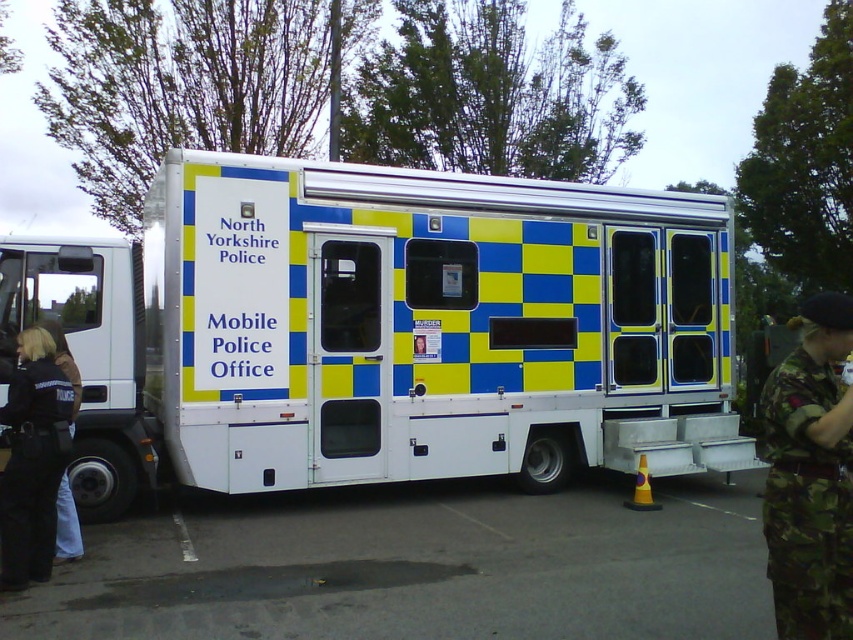
You are a police officer standing in front of the North Yorkshire Police Mobile Police Office. You notice two points marked on the side of the vehicle. The first point is at coordinate point (36, 502) and the second is at coordinate point (61, 342). Which point is closer to your current position?

Point (36, 502) is closer to the camera than point (61, 342), so the first point is closer to your current position.

You are a police officer standing in front of the North Yorkshire Police Mobile Police Office. You notice two black uniforms hanging on hooks near the entrance. One is labeled as the black uniform at lower left and the other as the black uniform at left. Which uniform is positioned lower on the hook?

The black uniform at lower left is located below the black uniform at left, so it is positioned lower on the hook.